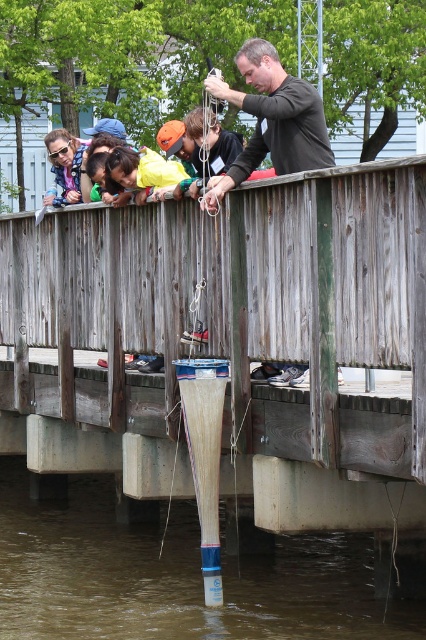
Question: Which object is positioned closest to the yellow shirt at upper left?

Choices:
 (A) matte black shirt at upper center
 (B) transparent plastic tube at lower center

Answer: (A)

Question: Which object is farther from the camera taking this photo?

Choices:
 (A) yellow shirt at upper left
 (B) transparent plastic tube at lower center
 (C) matte black shirt at upper center

Answer: (B)

Question: Can you confirm if transparent plastic tube at lower center is smaller than black matte shirt at upper center?

Choices:
 (A) yes
 (B) no

Answer: (A)

Question: Is matte black shirt at upper center to the left of yellow shirt at upper left from the viewer's perspective?

Choices:
 (A) yes
 (B) no

Answer: (B)

Question: Is matte black shirt at upper center to the left of yellow shirt at upper left from the viewer's perspective?

Choices:
 (A) yes
 (B) no

Answer: (B)

Question: Which point appears farthest from the camera in this image?

Choices:
 (A) (112, 150)
 (B) (221, 182)

Answer: (A)